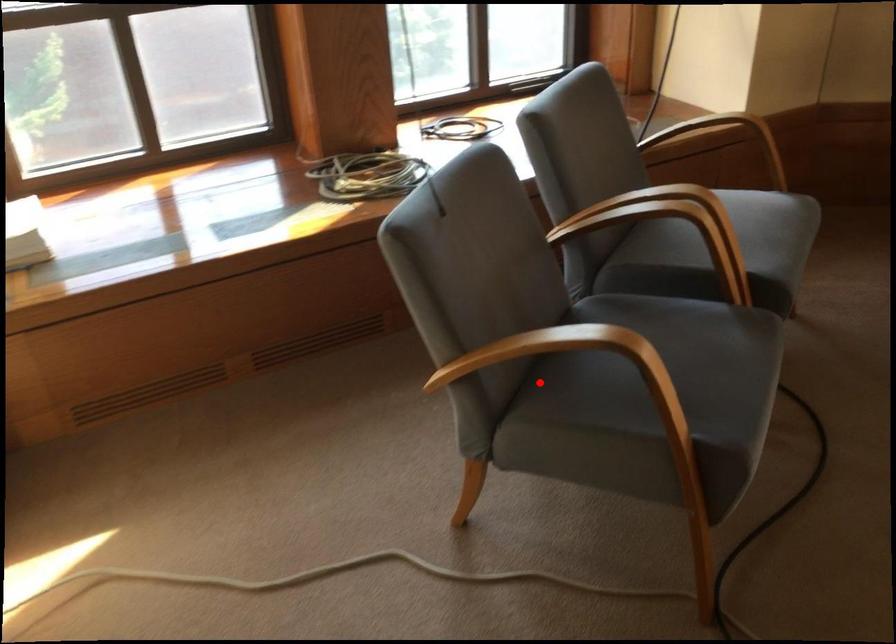
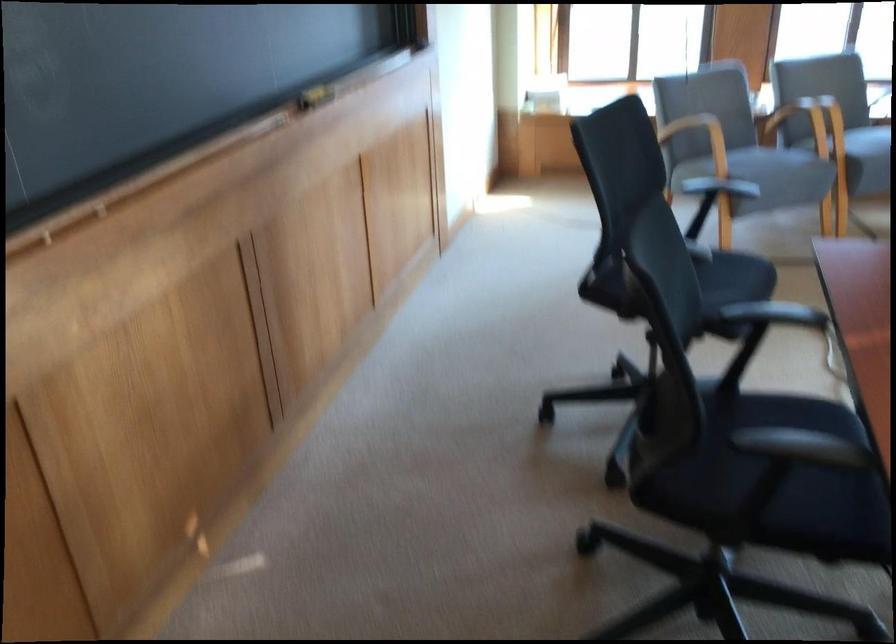
Question: I am providing you with two images of the same scene from different viewpoints. A red point is shown in image1. For the corresponding object point in image2, is it positioned nearer or farther from the camera?

Choices:
 (A) Nearer
 (B) Farther

Answer: (B)